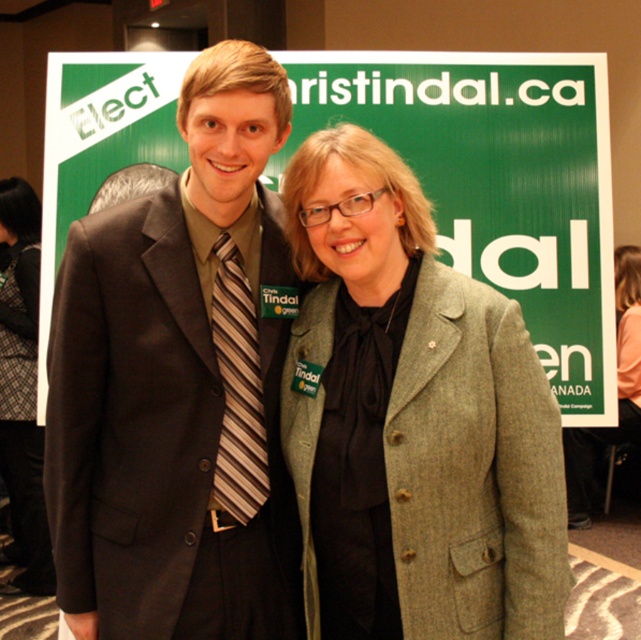
Question: Can you confirm if green tweed blazer at center is positioned below brown striped tie at center?

Choices:
 (A) no
 (B) yes

Answer: (A)

Question: Among these points, which one is nearest to the camera?

Choices:
 (A) (624, 358)
 (B) (222, 321)
 (C) (35, 451)
 (D) (487, 152)

Answer: (B)

Question: Which point appears closest to the camera in this image?

Choices:
 (A) (447, 250)
 (B) (17, 308)

Answer: (A)

Question: Which point is farther from the camera taking this photo?

Choices:
 (A) (265, 205)
 (B) (433, 96)
 (C) (253, 333)

Answer: (B)

Question: Is brown striped tie at center closer to the viewer compared to light brown textured blazer at center?

Choices:
 (A) no
 (B) yes

Answer: (B)

Question: Can you confirm if green tweed blazer at center is thinner than brown striped tie at center?

Choices:
 (A) no
 (B) yes

Answer: (A)